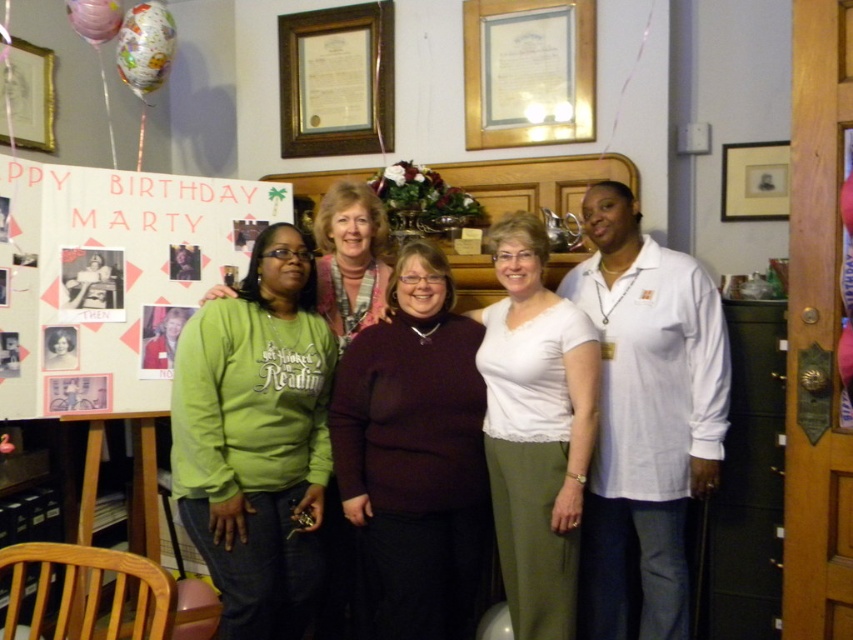
In the photo, there are two women wearing green sweatshirts. The first is wearing a green matte sweatshirt at left, and the second is wearing a green sweatshirt at center. Which one is positioned further to the left?

The green matte sweatshirt at left is positioned further to the left compared to the green sweatshirt at center.

You are a photographer at the birthday party and want to adjust the camera angle so that both the green matte sweatshirt at left and the green sweatshirt at center appear equally tall in the photo. Which direction should you move the camera? Explain your reasoning.

To make both the green matte sweatshirt at left and the green sweatshirt at center appear equally tall in the photo, you should move the camera closer to the green matte sweatshirt at left. Since the green matte sweatshirt at left is shorter in height compared to the green sweatshirt at center, positioning the camera closer to it will magnify its apparent size, balancing their heights in the frame.